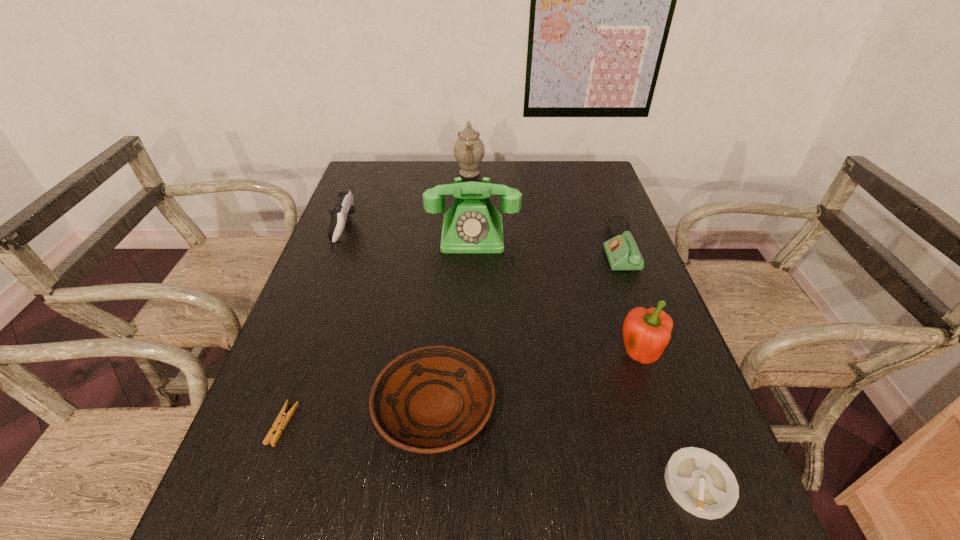
I want to click on chinaware, so click(x=469, y=150).

The height and width of the screenshot is (540, 960). Find the location of `the taller telephone`. the taller telephone is located at coordinates pos(472,224).

Locate an element on the screen. Image resolution: width=960 pixels, height=540 pixels. pepper is located at coordinates (646, 332).

Where is `the fourth tallest object`? the fourth tallest object is located at coordinates (344, 207).

The width and height of the screenshot is (960, 540). What are the coordinates of `the right telephone` in the screenshot? It's located at (622, 252).

The width and height of the screenshot is (960, 540). What are the coordinates of `the fifth tallest object` in the screenshot? It's located at (622, 252).

Locate an element on the screen. Image resolution: width=960 pixels, height=540 pixels. the sixth tallest object is located at coordinates (432, 399).

Image resolution: width=960 pixels, height=540 pixels. Find the location of `ashtray`. ashtray is located at coordinates (700, 482).

At what (x,y) coordinates should I click in order to perform the action: click on clothespin. Please return your answer as a coordinate pair (x, y). The width and height of the screenshot is (960, 540). Looking at the image, I should click on (282, 419).

I want to click on vacant area situated on the spout of the chinaware, so click(529, 173).